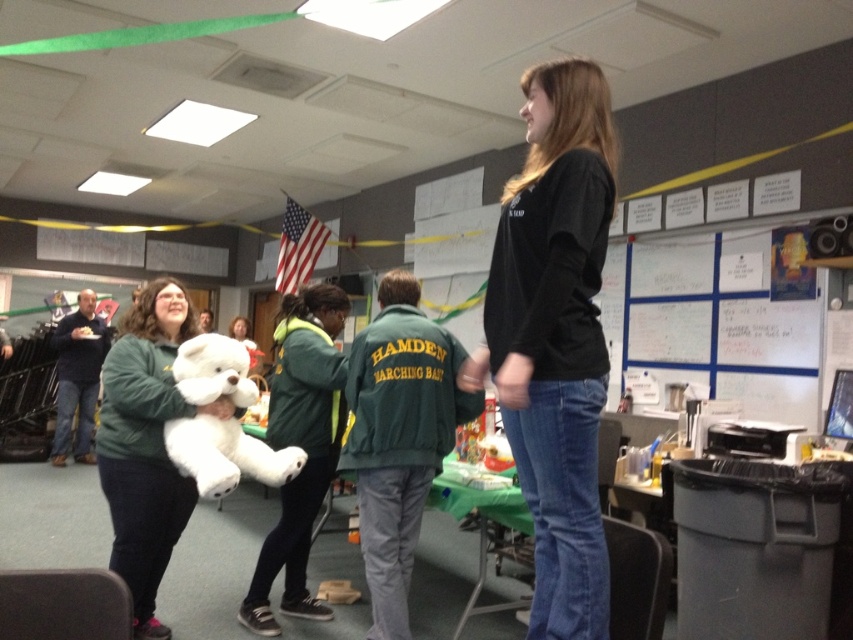
You are organizing a photo shoot and need to arrange two items on a shelf. The items are the black matte shirt at center and the green fleece jacket at center. If the shelf has limited space, which item should you place first to ensure both fit?

The black matte shirt at center has a smaller size compared to the green fleece jacket at center, so you should place the smaller black matte shirt at center first to ensure both items fit on the shelf.